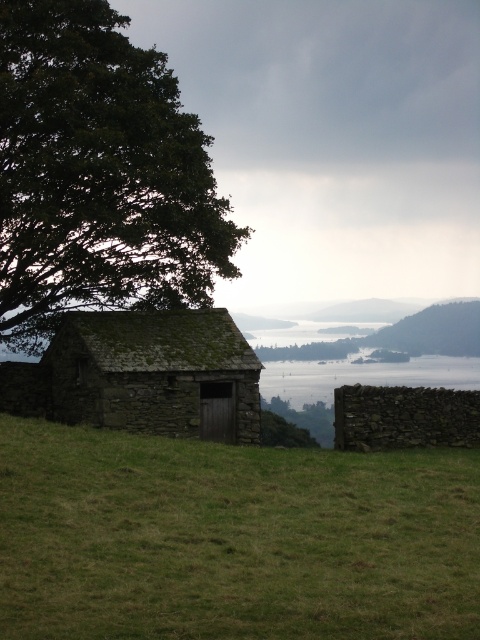
Question: Can you confirm if dark green leafy tree at upper left is wider than rusty stone hut at center?

Choices:
 (A) no
 (B) yes

Answer: (B)

Question: Is green grassy field at lower center wider than green mossy tree at upper center?

Choices:
 (A) no
 (B) yes

Answer: (A)

Question: Which of the following is the farthest from the observer?

Choices:
 (A) (94, 321)
 (B) (327, 342)
 (C) (325, 552)

Answer: (B)

Question: Which of these objects is positioned closest to the green grassy field at lower center?

Choices:
 (A) rusty stone hut at center
 (B) green mossy tree at upper center
 (C) dark green leafy tree at upper left

Answer: (A)

Question: Among these objects, which one is nearest to the camera?

Choices:
 (A) green grassy field at lower center
 (B) green mossy tree at upper center
 (C) rusty stone hut at center
 (D) dark green leafy tree at upper left

Answer: (A)

Question: Is dark green leafy tree at upper left in front of rusty stone hut at center?

Choices:
 (A) no
 (B) yes

Answer: (B)